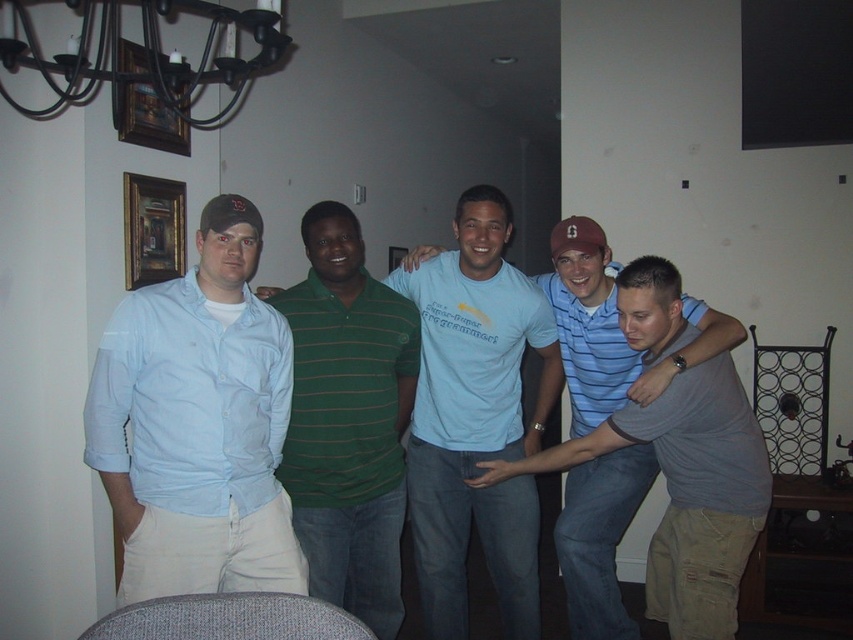
Question: Among these points, which one is nearest to the camera?

Choices:
 (A) (599, 372)
 (B) (534, 451)

Answer: (A)

Question: Which of the following is the farthest from the observer?

Choices:
 (A) (550, 276)
 (B) (570, 470)
 (C) (395, 493)
 (D) (444, 339)

Answer: (B)

Question: Is light blue cotton shirt at left below gray cotton t-shirt at center?

Choices:
 (A) no
 (B) yes

Answer: (A)

Question: Estimate the real-world distances between objects in this image. Which object is farther from the light blue cotton shirt at left?

Choices:
 (A) green striped polo shirt at center
 (B) black wrought iron chandelier at upper left
 (C) light blue t-shirt at center

Answer: (B)

Question: From the image, what is the correct spatial relationship of black wrought iron chandelier at upper left in relation to gray striped polo at center?

Choices:
 (A) below
 (B) above

Answer: (B)

Question: Is light blue t-shirt at center below black wrought iron chandelier at upper left?

Choices:
 (A) yes
 (B) no

Answer: (A)